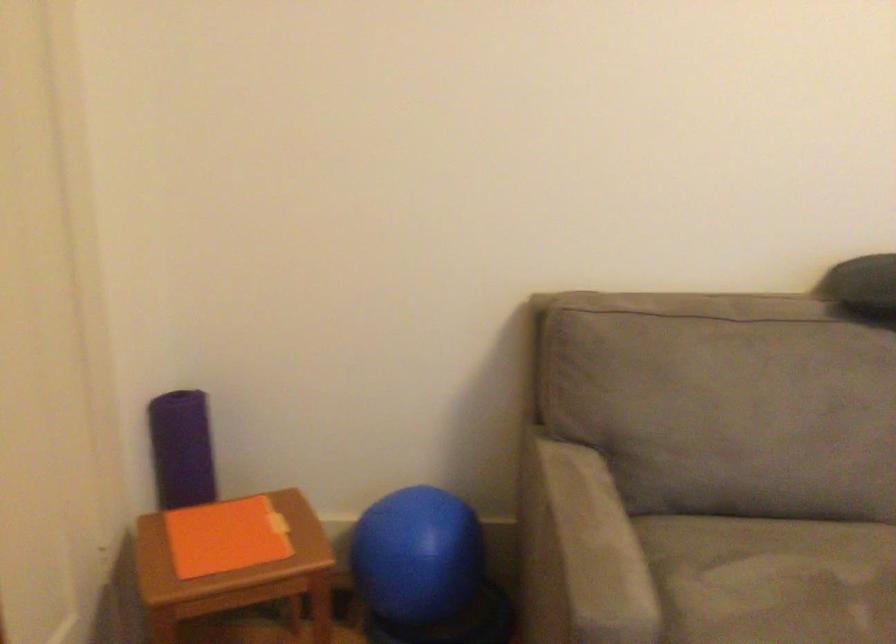
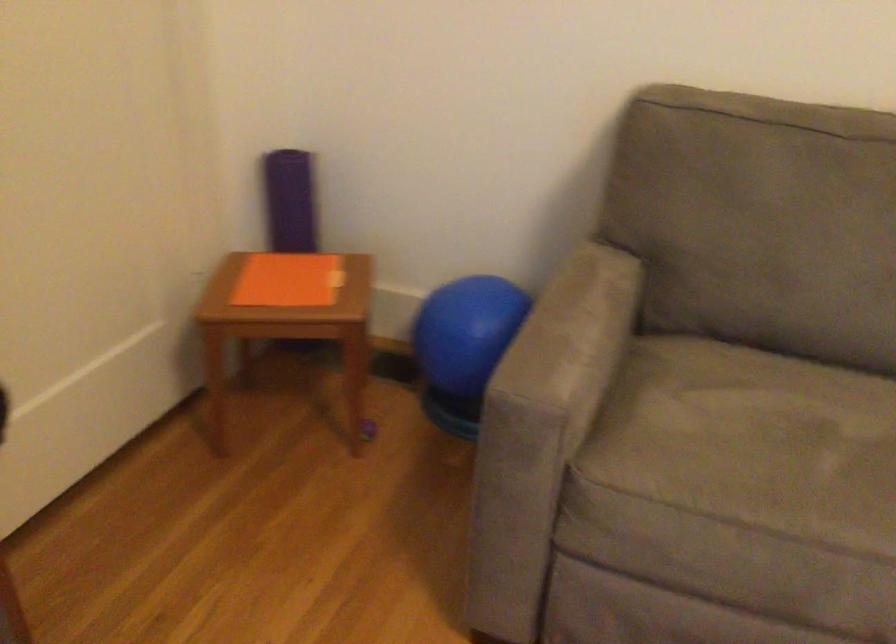
The point at (423,565) is marked in the first image. Where is the corresponding point in the second image?

(463, 345)